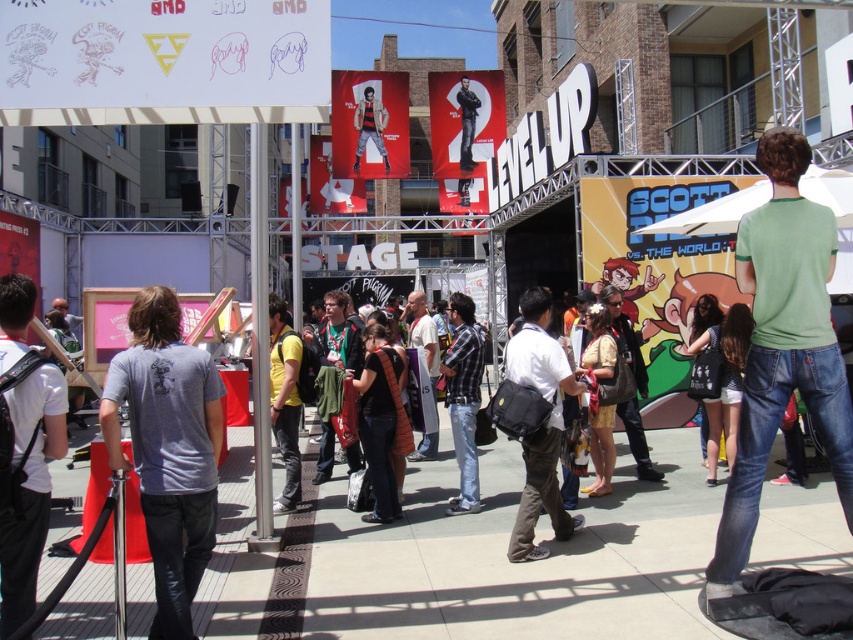
You are standing at the point labeled point [387,140] and want to move towards the stage area. Is the point labeled point [421,298] closer to the stage than your current position?

Point [387,140] is further to the camera than point [421,298], so the point labeled point [421,298] is closer to the stage than your current position.

You are standing at point (622, 328) and want to see the stage. Can you see the stage from your current position if there is a person in a green shirt blocking your view at point (335, 74)?

Point (335, 74) is behind point (622, 328), so the person in the green shirt at point (335, 74) is behind you and not blocking your view. You can see the stage from your current position.